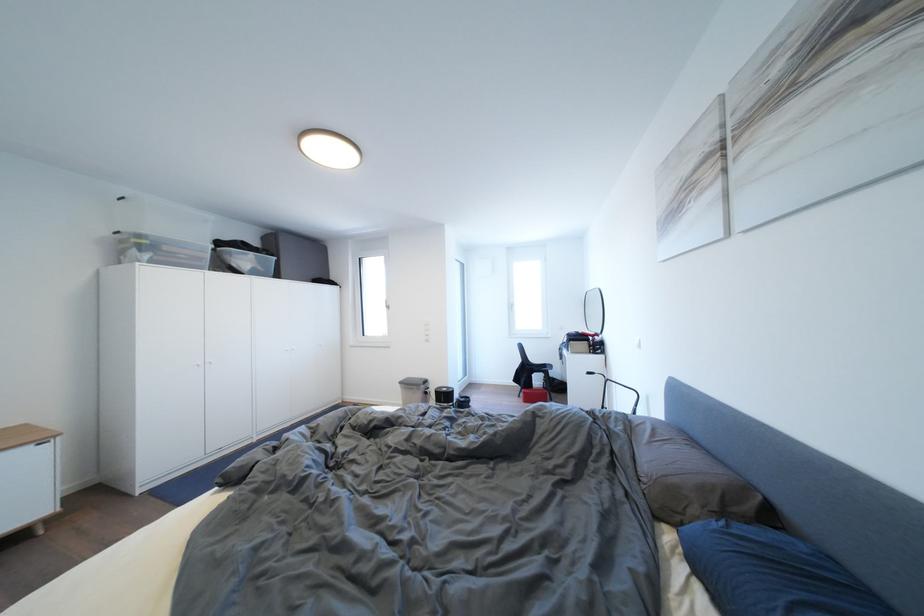
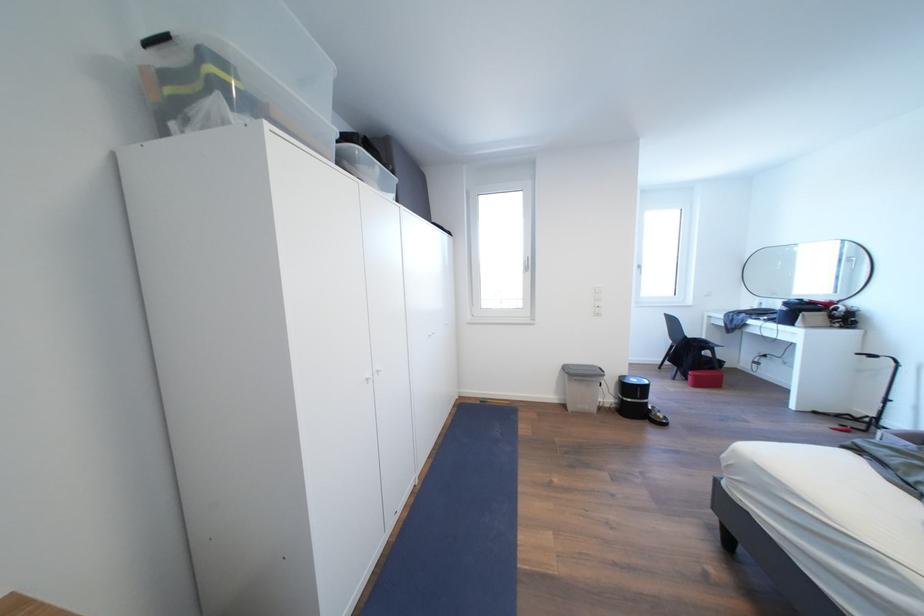
Find the pixel in the second image that matches point (532, 398) in the first image.

(703, 381)